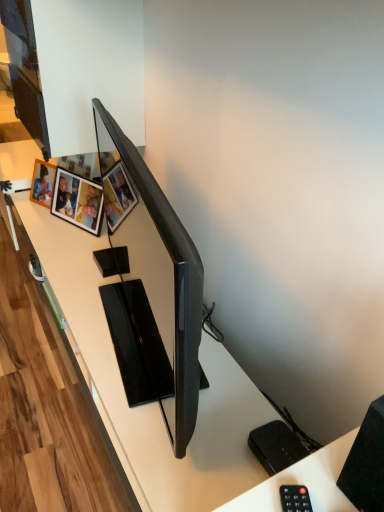
Question: Is black matte speaker at lower right completely or partially outside of wooden photo frame at upper left, which is the second picture frame in right-to-left order?

Choices:
 (A) no
 (B) yes

Answer: (B)

Question: Is black matte speaker at lower right positioned with its back to wooden photo frame at upper left, which is counted as the first picture frame, starting from the left?

Choices:
 (A) yes
 (B) no

Answer: (B)

Question: Is black matte speaker at lower right shorter than wooden photo frame at upper left, which is the second picture frame in right-to-left order?

Choices:
 (A) yes
 (B) no

Answer: (A)

Question: Is black matte speaker at lower right closer to the viewer compared to wooden photo frame at upper left, which is the second picture frame in right-to-left order?

Choices:
 (A) yes
 (B) no

Answer: (A)

Question: Can you confirm if black matte speaker at lower right is bigger than wooden photo frame at upper left, which is the second picture frame in right-to-left order?

Choices:
 (A) no
 (B) yes

Answer: (B)

Question: Considering the positions of matte black tv at center and wooden photo frame at upper left, which is the second picture frame in right-to-left order, in the image, is matte black tv at center wider or thinner than wooden photo frame at upper left, which is the second picture frame in right-to-left order,?

Choices:
 (A) wide
 (B) thin

Answer: (A)

Question: Do you think matte black tv at center is within wooden photo frame at upper left, which is the second picture frame in right-to-left order, or outside of it?

Choices:
 (A) outside
 (B) inside

Answer: (A)

Question: From a real-world perspective, is matte black tv at center physically located above or below wooden photo frame at upper left, which is the second picture frame in right-to-left order?

Choices:
 (A) below
 (B) above

Answer: (B)

Question: Considering their positions, is matte black tv at center located in front of or behind wooden photo frame at upper left, which is counted as the first picture frame, starting from the left?

Choices:
 (A) behind
 (B) front

Answer: (B)

Question: Is black plastic remote at lower right to the left or to the right of wooden photo frame at upper left, acting as the first picture frame starting from the right, in the image?

Choices:
 (A) right
 (B) left

Answer: (A)

Question: Considering the positions of black plastic remote at lower right and wooden photo frame at upper left, the 2th picture frame in the left-to-right sequence, in the image, is black plastic remote at lower right bigger or smaller than wooden photo frame at upper left, the 2th picture frame in the left-to-right sequence,?

Choices:
 (A) big
 (B) small

Answer: (B)

Question: Is point (291, 500) closer or farther from the camera than point (92, 224)?

Choices:
 (A) farther
 (B) closer

Answer: (B)

Question: From the image's perspective, relative to wooden photo frame at upper left, the 2th picture frame in the left-to-right sequence, is black plastic remote at lower right above or below?

Choices:
 (A) above
 (B) below

Answer: (B)

Question: Considering the relative positions of wooden photo frame at upper left, acting as the first picture frame starting from the right, and black matte speaker at lower right in the image provided, is wooden photo frame at upper left, acting as the first picture frame starting from the right, to the left or to the right of black matte speaker at lower right?

Choices:
 (A) right
 (B) left

Answer: (B)

Question: From a real-world perspective, is wooden photo frame at upper left, acting as the first picture frame starting from the right, positioned above or below black matte speaker at lower right?

Choices:
 (A) above
 (B) below

Answer: (B)